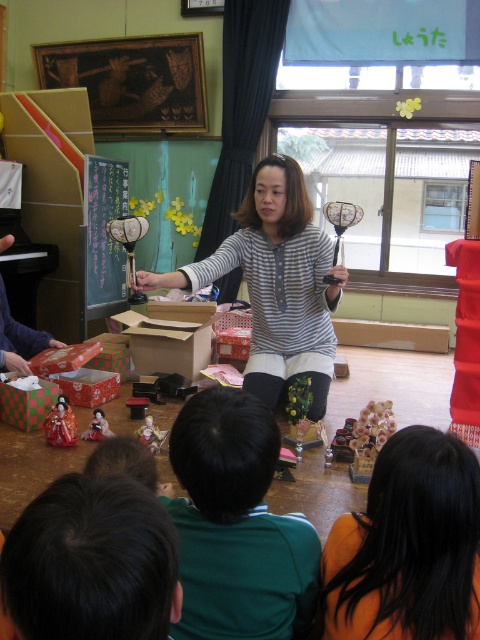
You are a teacher preparing for a craft activity. You have a striped fabric at center and a cardboard box at center. Which object is wider?

The striped fabric at center might be wider than cardboard box at center.

You are a photographer trying to capture a clear shot of both the striped fabric at center and the matte wooden doll at lower center. Since you can only focus on one object at a time, which object should you focus on to ensure the other remains in the background?

You should focus on the striped fabric at center because it is in front of the matte wooden doll at lower center, so the doll will naturally be in the background when the fabric is in focus.

You are a child sitting on the floor in the classroom scene. You want to grab the striped fabric at center and the matte wooden doll at lower center. Which object can you reach first if you stretch your arm forward?

The striped fabric at center is larger than the matte wooden doll at lower center, so it might be closer to you. However, without knowing their exact distance, it is impossible to determine which you can reach first based solely on size.